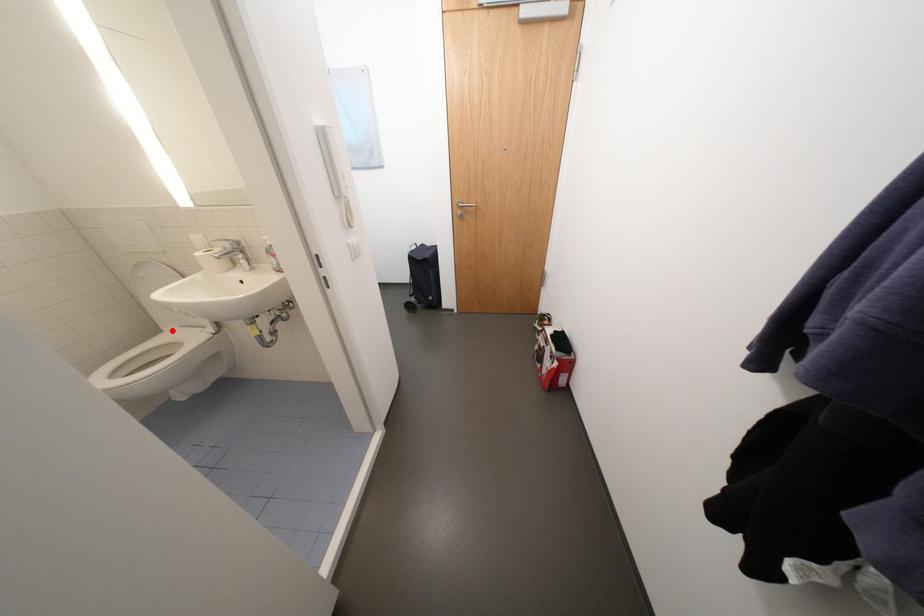
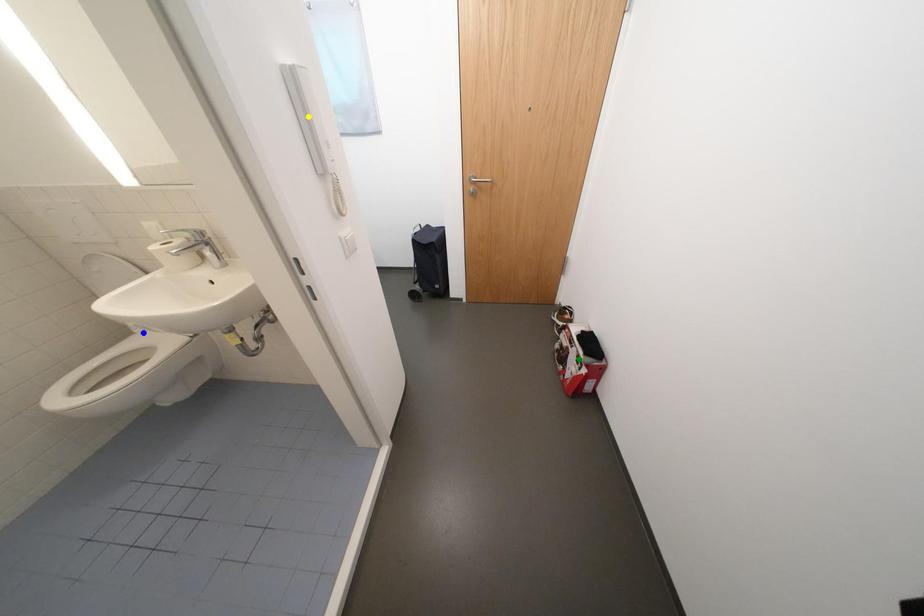
Question: I am providing you with two images of the same scene from different viewpoints. A red point is marked on the first image. You are given multiple points on the second image. Which point in image 2 is actually the same real-world point as the red point in image 1?

Choices:
 (A) green point
 (B) yellow point
 (C) blue point

Answer: (C)